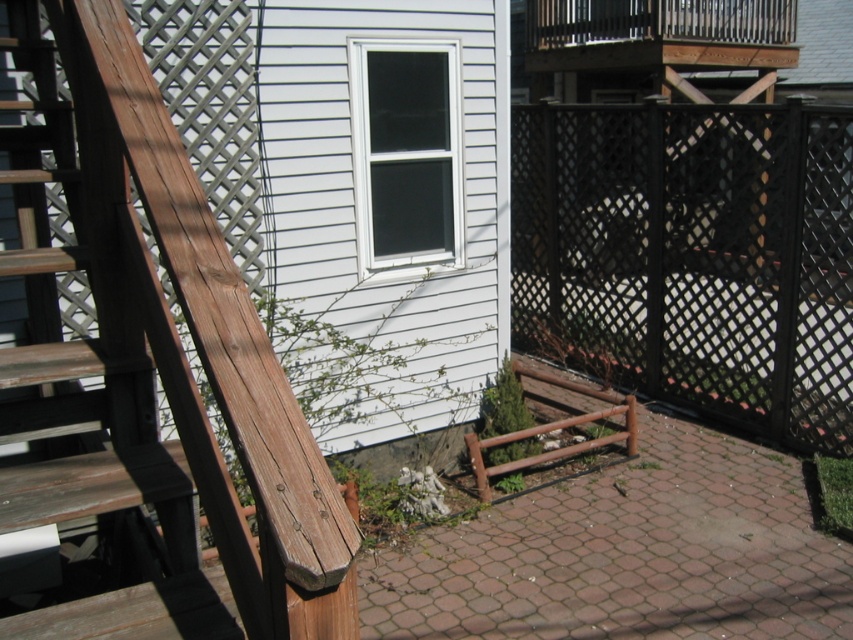
You are a painter who needs to move a ladder from the weathered wood ladder at left to the black lattice fence at lower right for painting. Considering the ladder is 12 feet long, will it fit through the space between them without being disassembled?

The distance between the weathered wood ladder at left and the black lattice fence at lower right is 14.59 feet. Since the ladder is 12 feet long, it will fit through the space as the distance between them is greater than the ladder length.

You are standing at the bottom of the wooden staircase and want to place a potted plant between the weathered wood ladder at left and the black lattice fence at lower right. Based on their positions, which object should the plant be closer to?

The weathered wood ladder at left is below the black lattice fence at lower right, so the plant should be placed closer to the weathered wood ladder at left to maintain a balanced arrangement between the two objects.